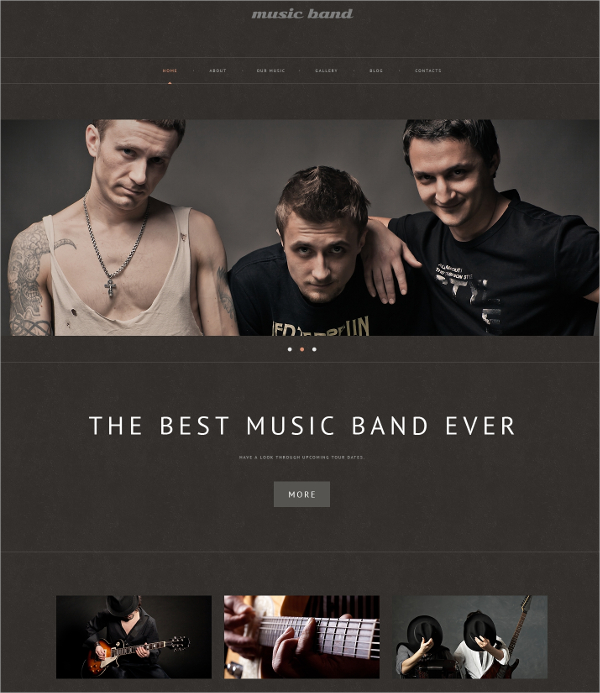
The image size is (600, 693). What are the coordinates of `picture` in the screenshot? It's located at (166, 619), (332, 619), (502, 611), (376, 199).